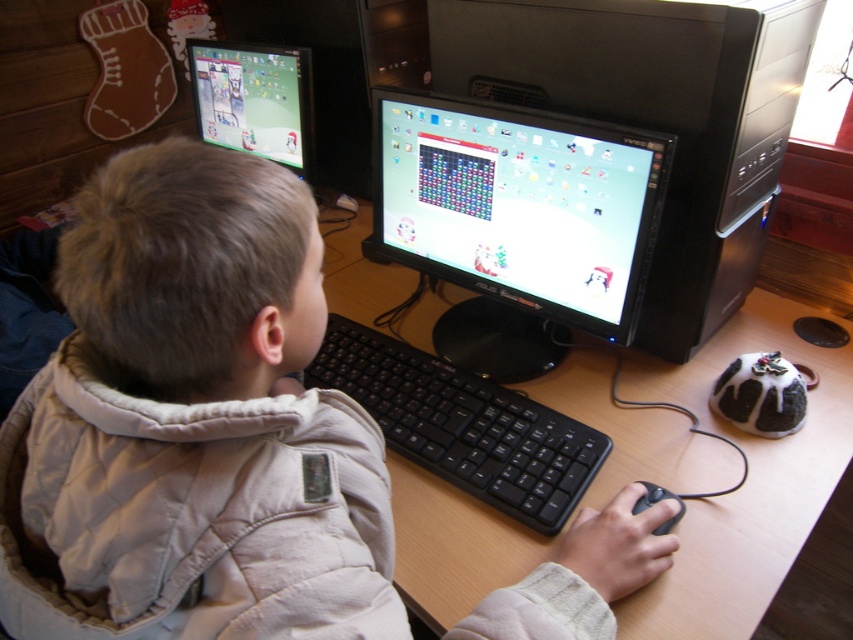
Question: Which object is the farthest from the matte black monitor at center?

Choices:
 (A) wooden at center
 (B) beige quilted jacket at center
 (C) black plastic keyboard at center
 (D) black matte mouse at lower right

Answer: (B)

Question: Is black plastic keyboard at center wider than black matte mouse at lower right?

Choices:
 (A) yes
 (B) no

Answer: (A)

Question: Can you confirm if black plastic monitor at center is positioned to the left of matte plastic monitor at upper left?

Choices:
 (A) no
 (B) yes

Answer: (A)

Question: Which of the following is the closest to the observer?

Choices:
 (A) matte plastic monitor at upper left
 (B) matte black monitor at center

Answer: (B)

Question: Does black plastic monitor at center appear under matte plastic monitor at upper left?

Choices:
 (A) yes
 (B) no

Answer: (A)

Question: Which object is the farthest from the black plastic keyboard at center?

Choices:
 (A) black matte mouse at lower right
 (B) wooden at center
 (C) matte plastic monitor at upper left
 (D) beige quilted jacket at center

Answer: (C)